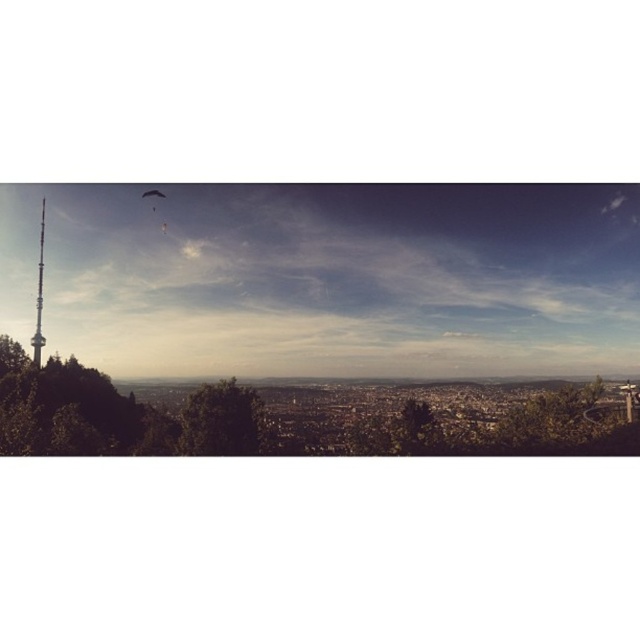
Can you confirm if green leafy tree at left is bigger than smooth silver spire at left?

Yes, green leafy tree at left is bigger than smooth silver spire at left.

In the scene shown: Who is taller, green leafy tree at left or smooth silver spire at left?

Result: smooth silver spire at left

Which is in front, point (68, 412) or point (42, 244)?

Point (68, 412) is more forward.

You are a GUI agent. You are given a task and a screenshot of the screen. Output one action in this format:
    pyautogui.click(x=<x>, y=<y>)
    Task: Click on the green leafy tree at left
    This screenshot has height=640, width=640.
    Given the screenshot: What is the action you would take?
    pyautogui.click(x=72, y=412)

Between green leafy tree at center and smooth silver spire at left, which one appears on the right side from the viewer's perspective?

From the viewer's perspective, green leafy tree at center appears more on the right side.

Does green leafy tree at center lie in front of smooth silver spire at left?

Yes.

Locate an element on the screen. green leafy tree at center is located at coordinates [x=220, y=420].

Where is `green leafy tree at center`? green leafy tree at center is located at coordinates (220, 420).

Is point (168, 428) closer to camera compared to point (211, 384)?

No.

Which is in front, point (74, 387) or point (202, 440)?

Point (202, 440) is in front.

Image resolution: width=640 pixels, height=640 pixels. Find the location of `green leafy tree at left`. green leafy tree at left is located at coordinates (72, 412).